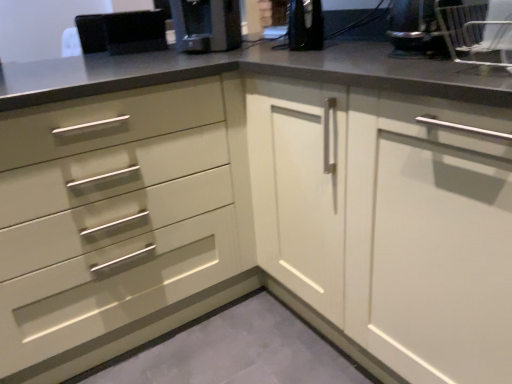
Question: From the image's perspective, is black plastic bowl at upper right located above or below matte white cabinet at right?

Choices:
 (A) above
 (B) below

Answer: (A)

Question: Based on their sizes in the image, would you say black plastic bowl at upper right is bigger or smaller than matte white cabinet at right?

Choices:
 (A) small
 (B) big

Answer: (A)

Question: Which of these objects is positioned closest to the black plastic bowl at upper right?

Choices:
 (A) satin black coffee machine at upper center
 (B) matte white cabinet at right

Answer: (B)

Question: Which of these objects is positioned closest to the black plastic bowl at upper right?

Choices:
 (A) satin black coffee machine at upper center
 (B) matte white cabinet at right

Answer: (B)